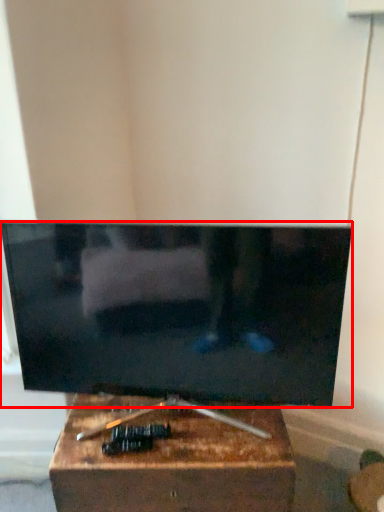
Question: From the image's perspective, what is the correct spatial positioning of television (annotated by the red box) in reference to furniture?

Choices:
 (A) above
 (B) below

Answer: (A)